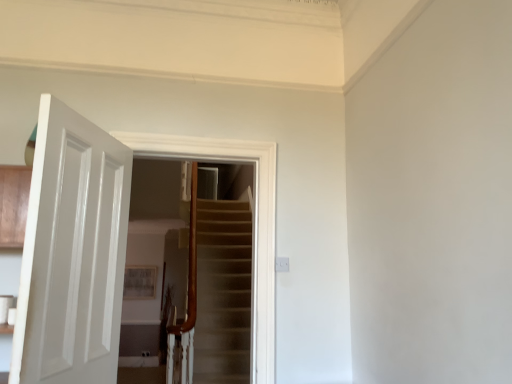
Question: Is white glossy door at center surrounded by white glossy door at left?

Choices:
 (A) yes
 (B) no

Answer: (B)

Question: From a real-world perspective, is white glossy door at left on white glossy door at center?

Choices:
 (A) no
 (B) yes

Answer: (A)

Question: From the image's perspective, is white glossy door at left above white glossy door at center?

Choices:
 (A) yes
 (B) no

Answer: (B)

Question: Considering the relative sizes of white glossy door at left and white glossy door at center in the image provided, is white glossy door at left shorter than white glossy door at center?

Choices:
 (A) no
 (B) yes

Answer: (B)

Question: Does white glossy door at left come in front of white glossy door at center?

Choices:
 (A) no
 (B) yes

Answer: (B)

Question: Is white glossy door at left turned away from white glossy door at center?

Choices:
 (A) no
 (B) yes

Answer: (A)

Question: Is white glossy door at center in front of white glossy door at left?

Choices:
 (A) yes
 (B) no

Answer: (B)

Question: From a real-world perspective, is white glossy door at center over white glossy door at left?

Choices:
 (A) no
 (B) yes

Answer: (B)

Question: Is white glossy door at center at the right side of white glossy door at left?

Choices:
 (A) no
 (B) yes

Answer: (B)

Question: Is white glossy door at center taller than white glossy door at left?

Choices:
 (A) yes
 (B) no

Answer: (A)

Question: Does white glossy door at center have a larger size compared to white glossy door at left?

Choices:
 (A) yes
 (B) no

Answer: (A)

Question: Considering the relative sizes of white glossy door at center and white glossy door at left in the image provided, is white glossy door at center smaller than white glossy door at left?

Choices:
 (A) yes
 (B) no

Answer: (B)

Question: From the image's perspective, relative to white glossy door at left, is white glossy door at center above or below?

Choices:
 (A) below
 (B) above

Answer: (B)